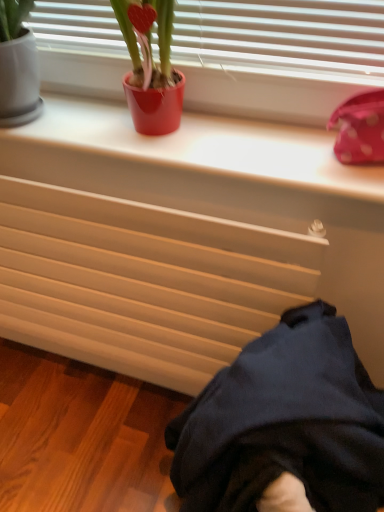
Locate an element on the screen. This screenshot has width=384, height=512. vacant area that lies to the right of shiny red pot at upper center is located at coordinates (228, 134).